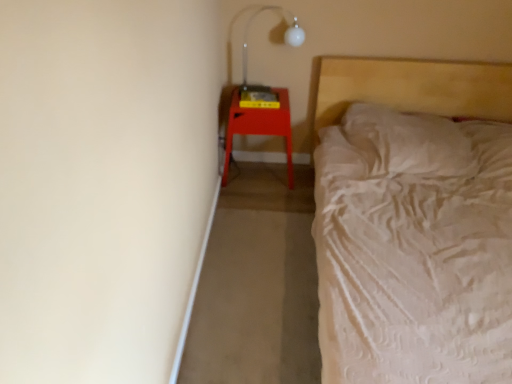
Question: Is transparent plastic lamp at upper right looking in the opposite direction of matte red stool at right?

Choices:
 (A) yes
 (B) no

Answer: (B)

Question: Does transparent plastic lamp at upper right have a lesser height compared to matte red stool at right?

Choices:
 (A) no
 (B) yes

Answer: (B)

Question: Considering the relative sizes of transparent plastic lamp at upper right and matte red stool at right in the image provided, is transparent plastic lamp at upper right thinner than matte red stool at right?

Choices:
 (A) yes
 (B) no

Answer: (A)

Question: Is transparent plastic lamp at upper right positioned behind matte red stool at right?

Choices:
 (A) no
 (B) yes

Answer: (A)

Question: Would you say matte red stool at right is part of transparent plastic lamp at upper right's contents?

Choices:
 (A) no
 (B) yes

Answer: (A)

Question: Choose the correct answer: Is matte red stool at right inside transparent plastic lamp at upper right or outside it?

Choices:
 (A) outside
 (B) inside

Answer: (A)

Question: From the image's perspective, is matte red stool at right located above or below transparent plastic lamp at upper right?

Choices:
 (A) above
 (B) below

Answer: (B)

Question: In terms of width, does matte red stool at right look wider or thinner when compared to transparent plastic lamp at upper right?

Choices:
 (A) wide
 (B) thin

Answer: (A)

Question: In the image, is matte red stool at right on the left side or the right side of transparent plastic lamp at upper right?

Choices:
 (A) left
 (B) right

Answer: (A)

Question: Considering the positions of point (245, 84) and point (345, 87), is point (245, 84) closer or farther from the camera than point (345, 87)?

Choices:
 (A) farther
 (B) closer

Answer: (A)

Question: Is transparent plastic lamp at upper right taller or shorter than white textured bed at right?

Choices:
 (A) tall
 (B) short

Answer: (B)

Question: In terms of width, does transparent plastic lamp at upper right look wider or thinner when compared to white textured bed at right?

Choices:
 (A) thin
 (B) wide

Answer: (A)

Question: From the image's perspective, relative to white textured bed at right, is transparent plastic lamp at upper right above or below?

Choices:
 (A) above
 (B) below

Answer: (A)

Question: In the image, is white textured bed at right on the left side or the right side of matte red stool at right?

Choices:
 (A) right
 (B) left

Answer: (A)

Question: Is white textured bed at right taller or shorter than matte red stool at right?

Choices:
 (A) short
 (B) tall

Answer: (B)